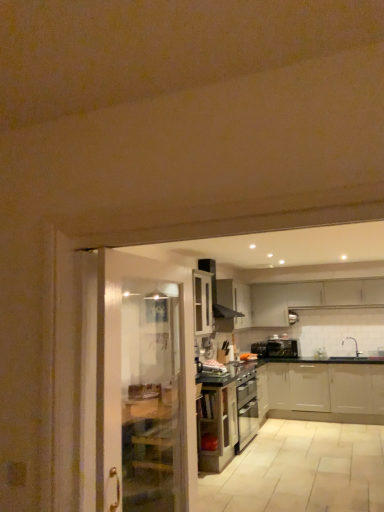
This screenshot has height=512, width=384. Find the location of `wooden cabinet at center`. wooden cabinet at center is located at coordinates (216, 426).

Describe the element at coordinates (216, 426) in the screenshot. I see `wooden cabinet at center` at that location.

The height and width of the screenshot is (512, 384). Find the location of `wooden cabinet at center`. wooden cabinet at center is located at coordinates (216, 426).